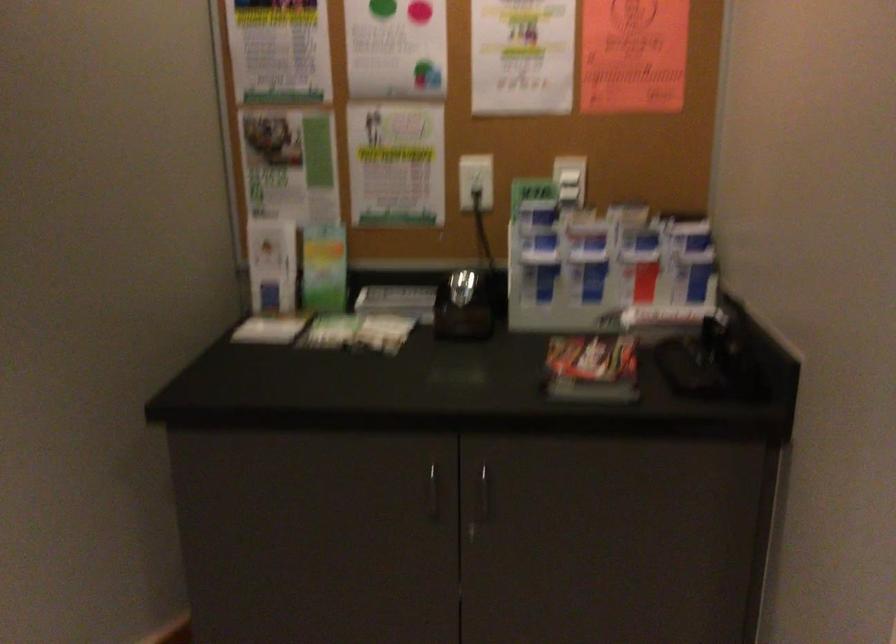
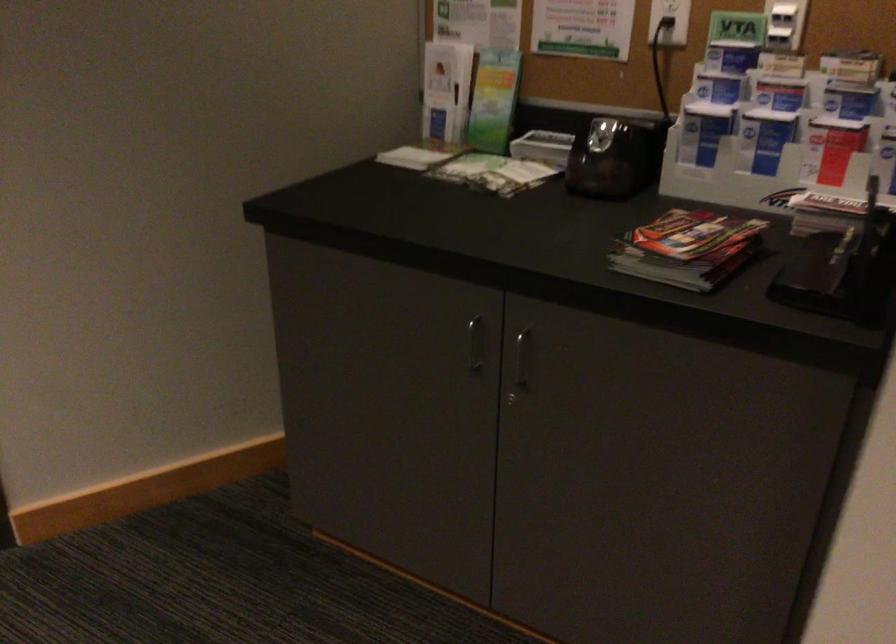
The point at (541, 272) is marked in the first image. Where is the corresponding point in the second image?

(702, 131)